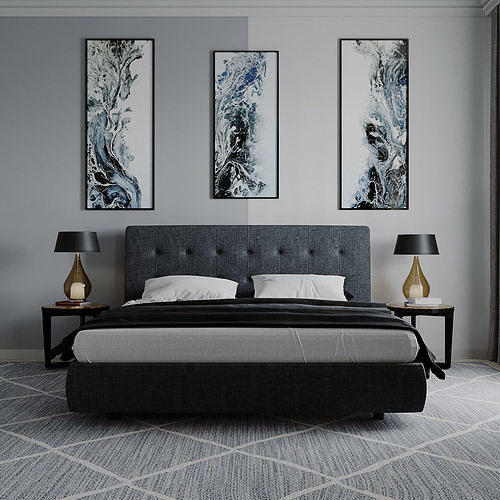
Identify the location of pillow. The height and width of the screenshot is (500, 500). (187, 280), (293, 288).